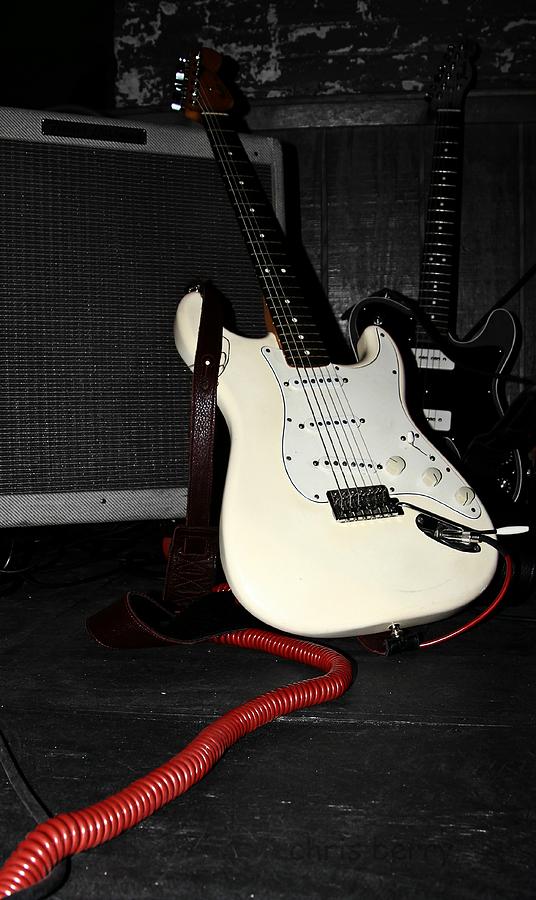
You are a GUI agent. You are given a task and a screenshot of the screen. Output one action in this format:
    pyautogui.click(x=<x>, y=<y>)
    Task: Click on the floor
    Image resolution: width=536 pixels, height=900 pixels.
    Given the screenshot: What is the action you would take?
    click(124, 699)